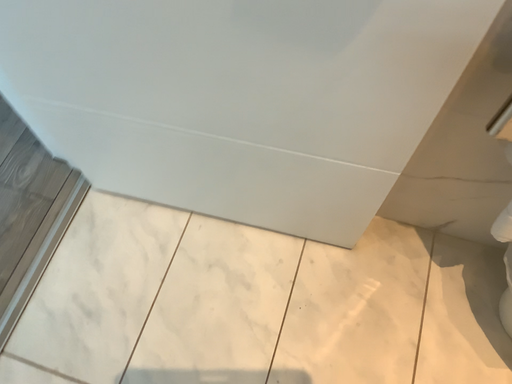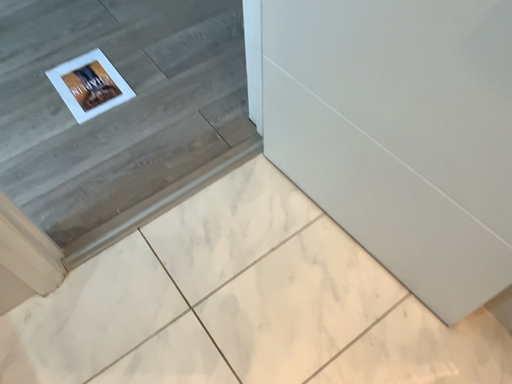
Question: How did the camera likely rotate when shooting the video?

Choices:
 (A) rotated left
 (B) rotated right

Answer: (A)